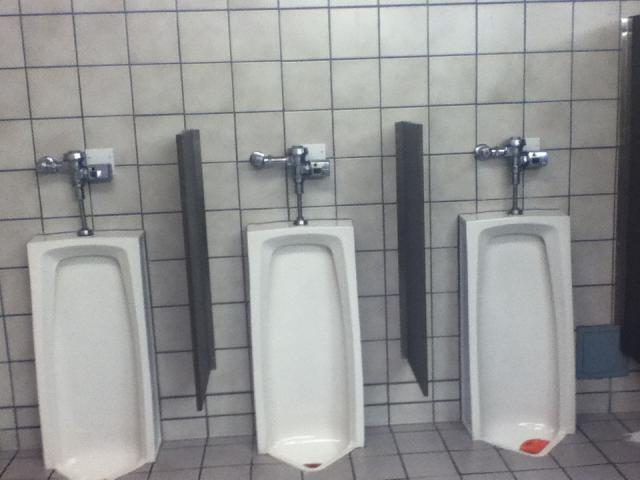
The image size is (640, 480). What are the coordinates of `bottom tile` in the screenshot? It's located at (223, 477), (233, 463).